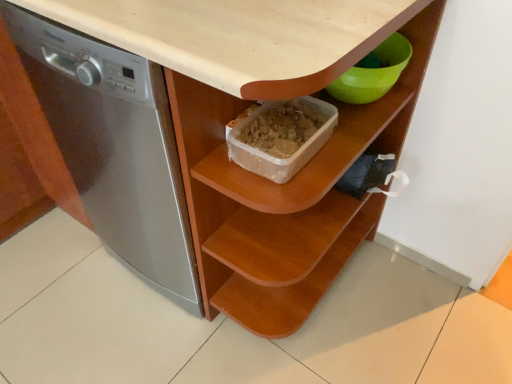
Question: From a real-world perspective, is wooden container at center positioned under satin silver dishwasher at left based on gravity?

Choices:
 (A) yes
 (B) no

Answer: (A)

Question: Is wooden container at center far away from satin silver dishwasher at left?

Choices:
 (A) no
 (B) yes

Answer: (A)

Question: Considering the relative sizes of wooden container at center and satin silver dishwasher at left in the image provided, is wooden container at center wider than satin silver dishwasher at left?

Choices:
 (A) no
 (B) yes

Answer: (A)

Question: Is wooden container at center with satin silver dishwasher at left?

Choices:
 (A) yes
 (B) no

Answer: (B)

Question: Can you confirm if wooden container at center is taller than satin silver dishwasher at left?

Choices:
 (A) no
 (B) yes

Answer: (A)

Question: Is wooden container at center turned away from satin silver dishwasher at left?

Choices:
 (A) yes
 (B) no

Answer: (A)

Question: Is satin silver dishwasher at left shorter than wooden container at center?

Choices:
 (A) yes
 (B) no

Answer: (B)

Question: Would you say wooden container at center is part of satin silver dishwasher at left's contents?

Choices:
 (A) no
 (B) yes

Answer: (A)

Question: Would you consider satin silver dishwasher at left to be distant from wooden container at center?

Choices:
 (A) no
 (B) yes

Answer: (A)

Question: Considering the relative sizes of satin silver dishwasher at left and wooden container at center in the image provided, is satin silver dishwasher at left bigger than wooden container at center?

Choices:
 (A) yes
 (B) no

Answer: (A)

Question: Is satin silver dishwasher at left positioned before wooden container at center?

Choices:
 (A) no
 (B) yes

Answer: (B)

Question: Is satin silver dishwasher at left positioned beyond the bounds of wooden container at center?

Choices:
 (A) yes
 (B) no

Answer: (A)

Question: Considering their positions, is wooden container at center located in front of or behind satin silver dishwasher at left?

Choices:
 (A) front
 (B) behind

Answer: (B)